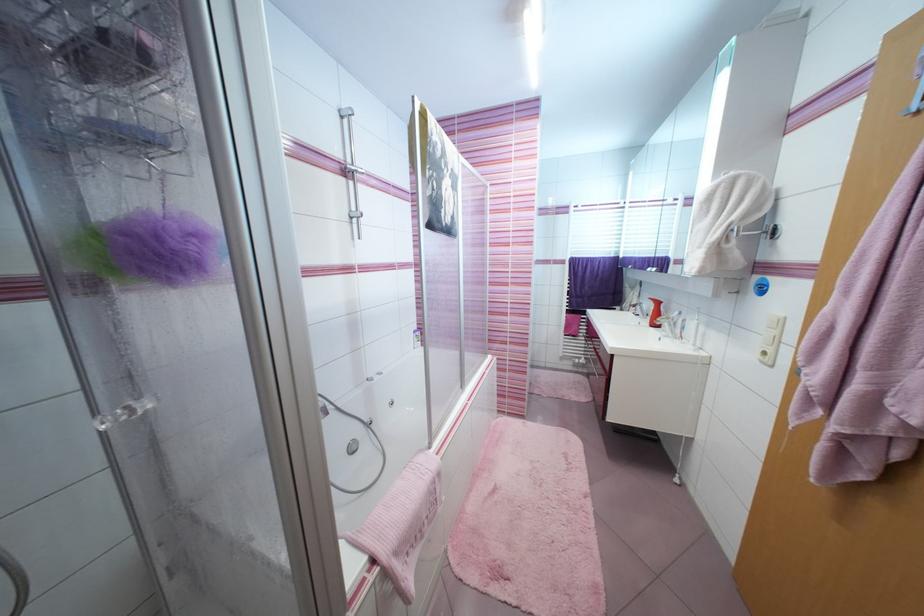
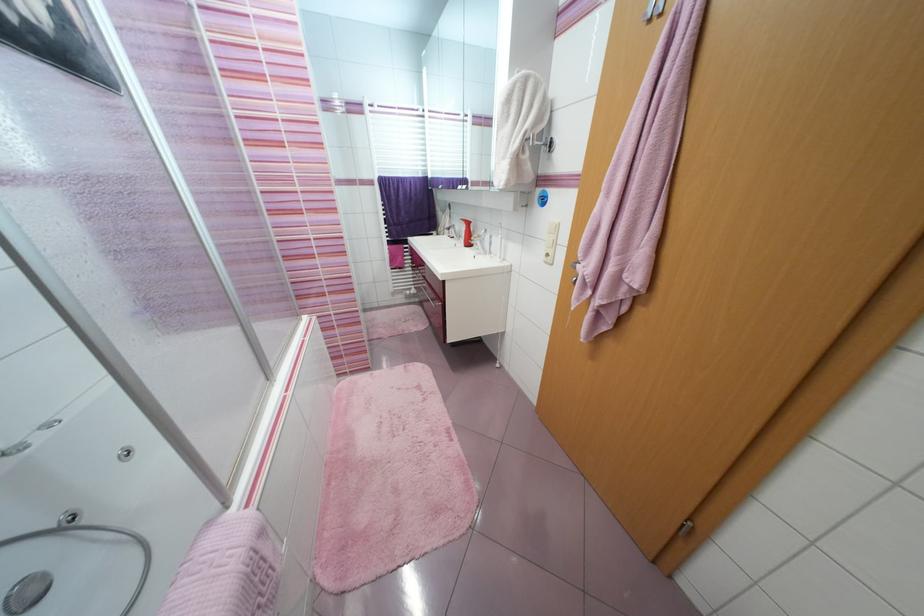
From the picture: The images are taken continuously from a first-person perspective. In which direction is your viewpoint rotating?

The camera's rotation is toward right-down.